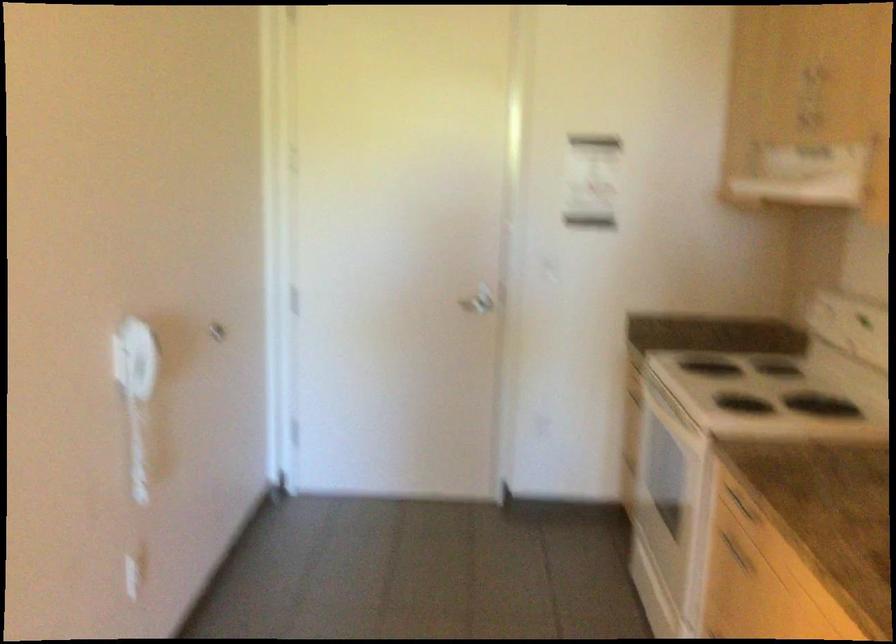
Find where to pull the drawer handle. Please return your answer as a coordinate pair (x, y).

(735, 552)